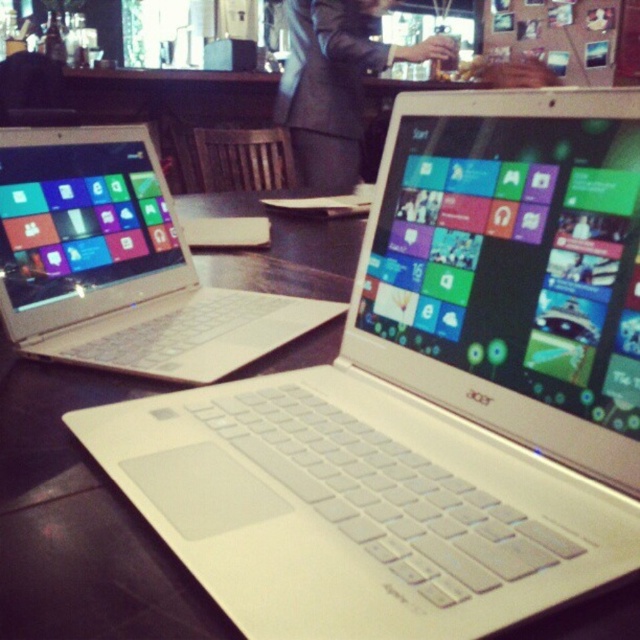
You are a delivery person who needs to leave a package on the table where the white plastic laptop at left and the dark suit at center are located. Can you place the package between them without moving either object?

The white plastic laptop at left is closer to the viewer than the dark suit at center, so there is space between them for the package to be placed.

You are a customer in a cafe and see the white plastic laptop at left and the dark suit at center. Which object is closer to the counter?

The white plastic laptop at left is located below dark suit at center, meaning it is closer to the counter since it is positioned lower in the image.